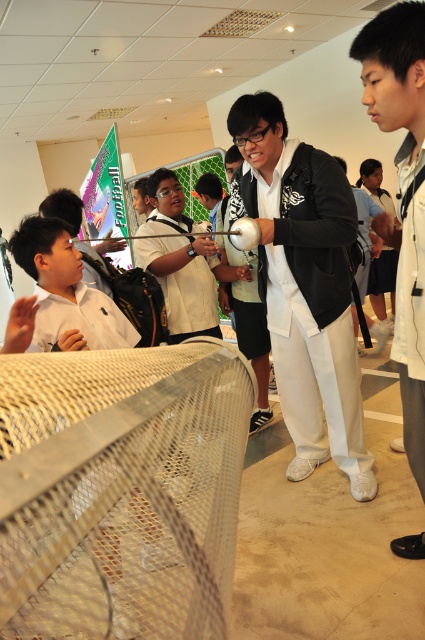
You are a photographer standing in front of the metallic mesh tennis net at center. You want to take a closeup photo of the net without any distortion. What is the minimum distance you should maintain from the net to avoid distortion?

The minimum distance you should maintain from the metallic mesh tennis net at center to avoid distortion is 12.25 inches, as that is the distance from the camera to the net.

You are a student participating in a science experiment. You need to determine if you can safely pass a 1.2 meter long ruler between the metallic mesh tennis net at center and the black matte jacket at center without touching either. Can you do this?

The metallic mesh tennis net at center and the black matte jacket at center are 1.47 meters apart. Since the ruler is 1.2 meters long, it can fit between them without touching either object.

You are an observer in the science demonstration. You notice the metallic mesh tennis net at center and the black matte jacket at center. Which object appears smaller in size?

The metallic mesh tennis net at center appears smaller in size compared to the black matte jacket at center.